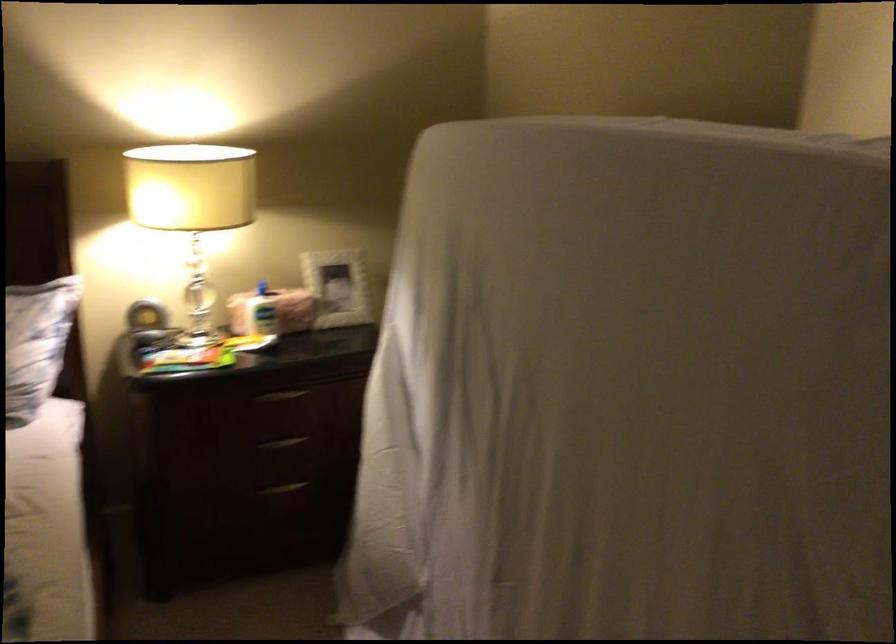
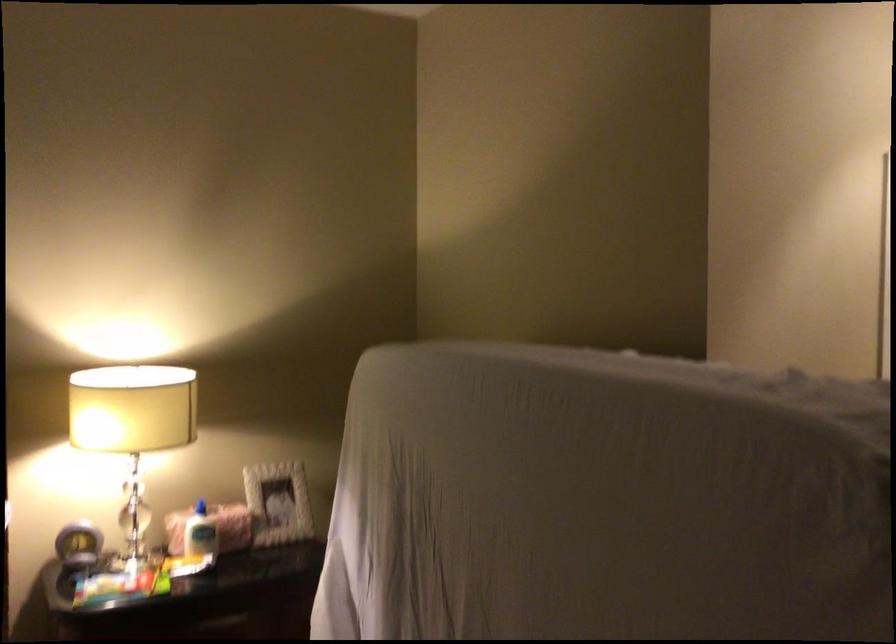
Question: The first image is from the beginning of the video and the second image is from the end. How did the camera likely rotate when shooting the video?

Choices:
 (A) Left
 (B) Right
 (C) Up
 (D) Down

Answer: (C)